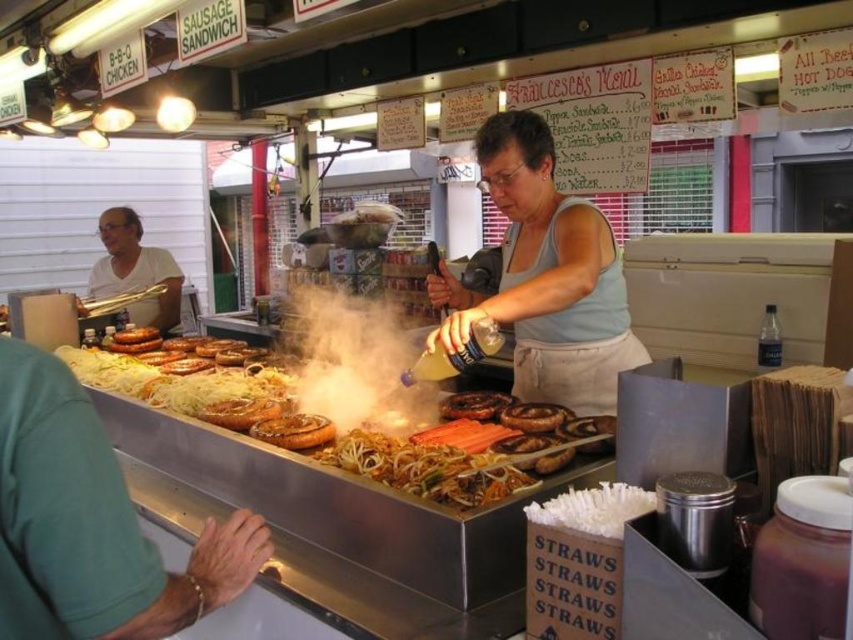
Which is behind, point (527, 285) or point (469, 417)?

Point (469, 417)

Which is in front, point (529, 355) or point (500, 401)?

Point (500, 401)

Where is `gray fabric apron at center`? This screenshot has width=853, height=640. gray fabric apron at center is located at coordinates (544, 276).

Which of these two, gray fabric apron at center or slightly browned wood sausages at center, stands taller?

With more height is gray fabric apron at center.

Can you confirm if gray fabric apron at center is thinner than slightly browned wood sausages at center?

Yes, gray fabric apron at center is thinner than slightly browned wood sausages at center.

What do you see at coordinates (544, 276) in the screenshot?
I see `gray fabric apron at center` at bounding box center [544, 276].

Image resolution: width=853 pixels, height=640 pixels. I want to click on gray fabric apron at center, so 544,276.

Is white smoke at center positioned in front of matte white shirt at left?

Yes, white smoke at center is closer to the viewer.

Who is positioned more to the right, white smoke at center or matte white shirt at left?

Positioned to the right is white smoke at center.

The image size is (853, 640). What do you see at coordinates (354, 358) in the screenshot?
I see `white smoke at center` at bounding box center [354, 358].

Locate an element on the screen. This screenshot has height=640, width=853. white smoke at center is located at coordinates (354, 358).